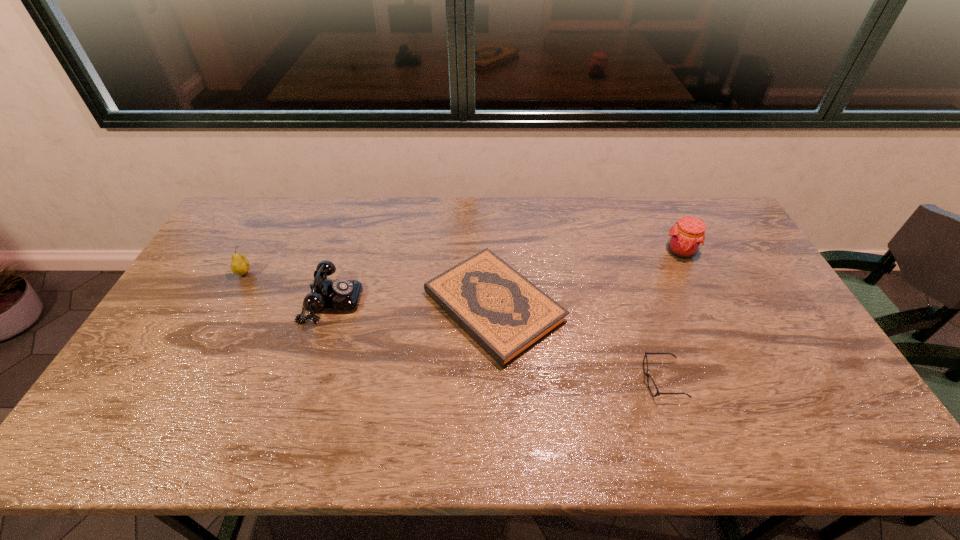
Identify the location of free spot located 0.360m on the front-facing side of the second object from right to left. The width and height of the screenshot is (960, 540). (503, 380).

At what (x,y) coordinates should I click in order to perform the action: click on vacant space located on the front-facing side of the second object from right to left. Please return your answer as a coordinate pair (x, y). This screenshot has height=540, width=960. Looking at the image, I should click on [x=557, y=380].

The width and height of the screenshot is (960, 540). I want to click on free space located 0.340m on the front-facing side of the second object from right to left, so click(511, 380).

Locate an element on the screen. The width and height of the screenshot is (960, 540). object positioned at the left edge is located at coordinates (239, 265).

This screenshot has width=960, height=540. Find the location of `vacant space at the far edge`. vacant space at the far edge is located at coordinates (372, 215).

In the image, there is a desktop. What are the coordinates of `free region at the near edge` in the screenshot? It's located at (623, 422).

Where is `vacant space at the left edge of the desktop`? This screenshot has width=960, height=540. vacant space at the left edge of the desktop is located at coordinates (203, 259).

Where is `vacant space at the right edge of the desktop`? vacant space at the right edge of the desktop is located at coordinates (750, 302).

Image resolution: width=960 pixels, height=540 pixels. What are the coordinates of `vacant space at the far left corner of the desktop` in the screenshot? It's located at (277, 210).

Identify the location of free point at the far right corner. This screenshot has height=540, width=960. (686, 197).